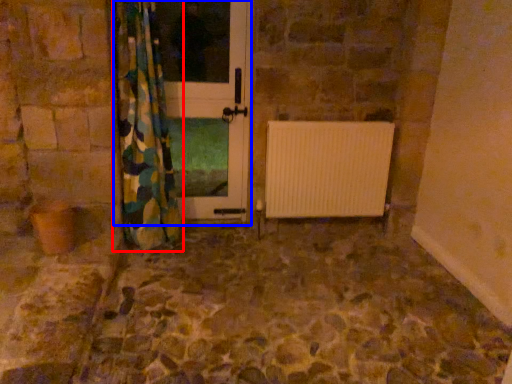
Question: Among these objects, which one is farthest to the camera, curtain (highlighted by a red box) or screen door (highlighted by a blue box)?

Choices:
 (A) curtain
 (B) screen door

Answer: (B)